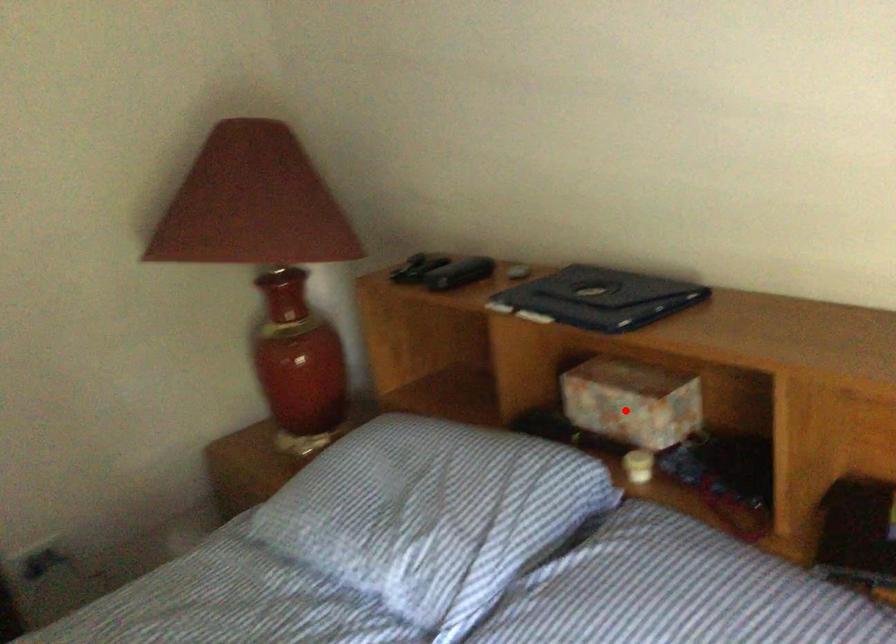
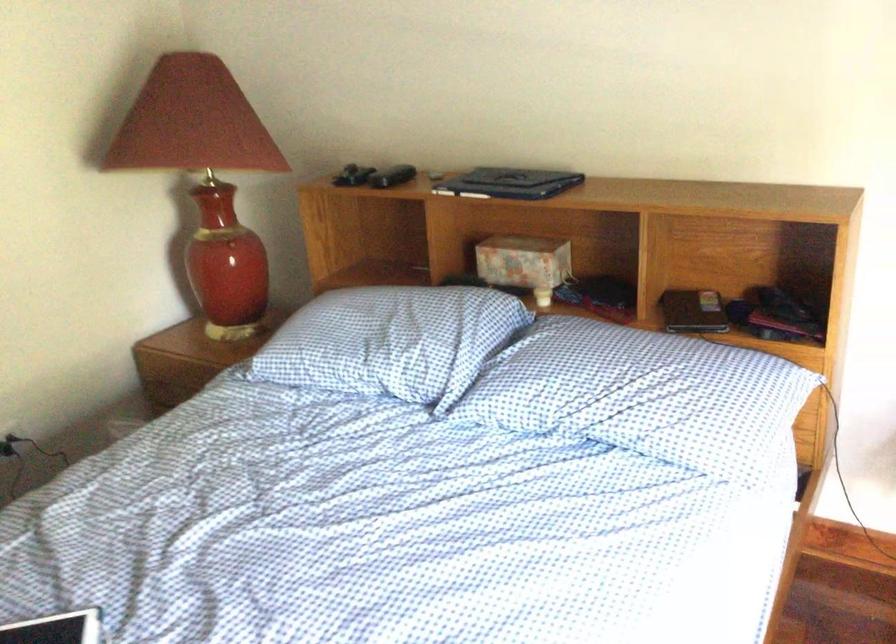
Question: I am providing you with two images of the same scene from different viewpoints. A red point is shown in image1. For the corresponding object point in image2, is it positioned nearer or farther from the camera?

Choices:
 (A) Nearer
 (B) Farther

Answer: (B)